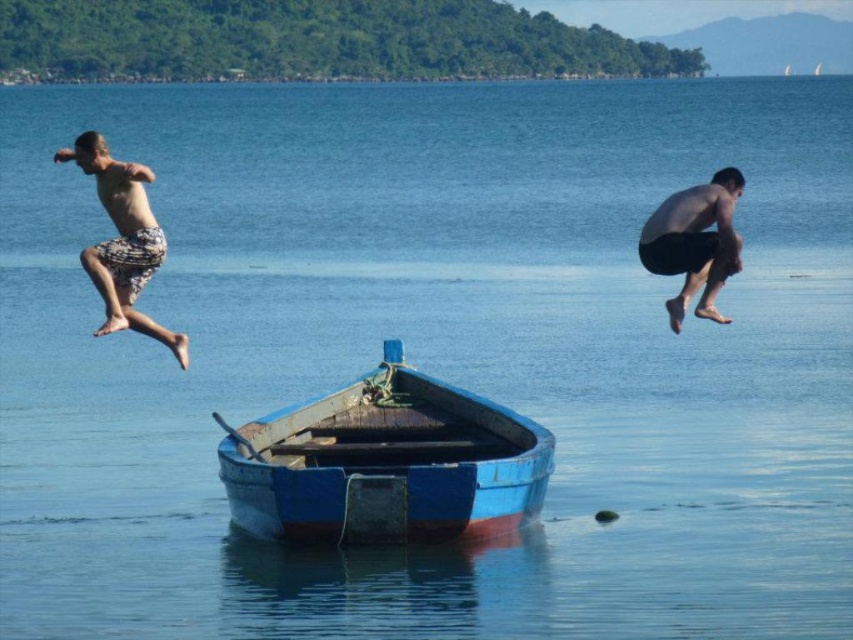
You are standing at the shore and want to throw a rope to the printed shorts man at left. The rope you have can reach up to 30 meters. Do you think you can reach him?

The printed shorts man at left and viewer are 31.12 meters apart from each other. Since the rope can only reach up to 30 meters, you cannot reach him.

You are standing on the shore and want to reach the blue wooden boat at center and the black matte shorts at right. Which object is closer to you?

The blue wooden boat at center is closer to the viewer than the black matte shorts at right, so the boat is closer.

What is located at the coordinates point (386, 464) in the image?

The blue wooden boat at center is located at point (386, 464).